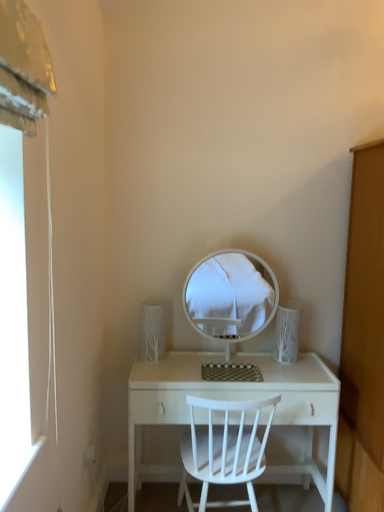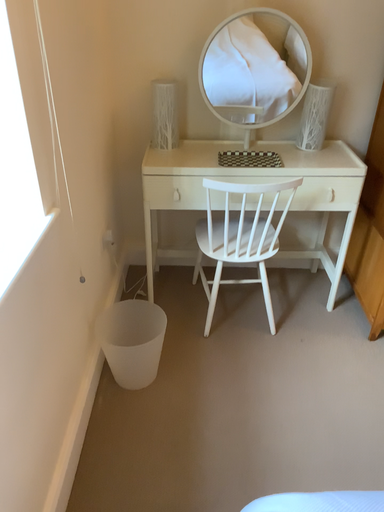
Question: How did the camera likely rotate when shooting the video?

Choices:
 (A) rotated downward
 (B) rotated upward

Answer: (A)